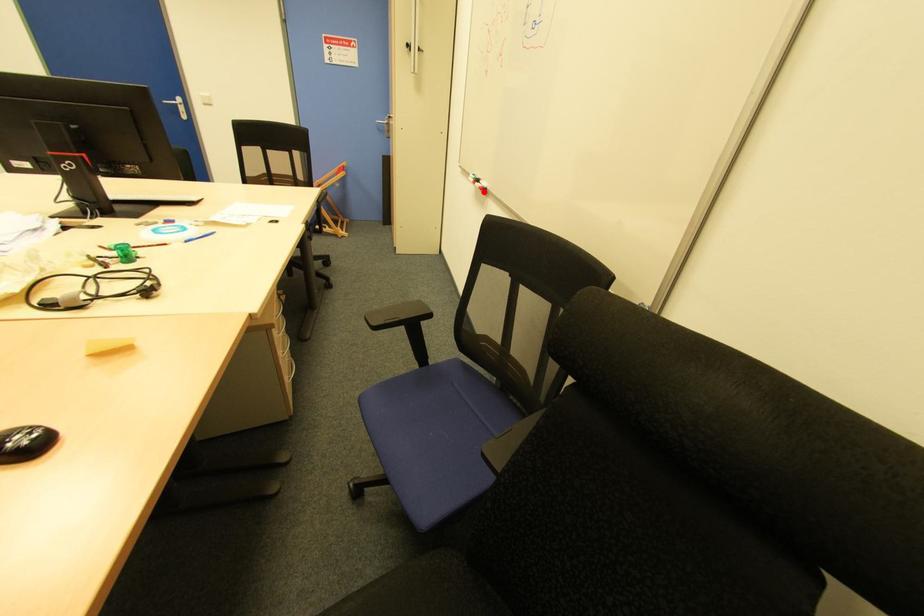
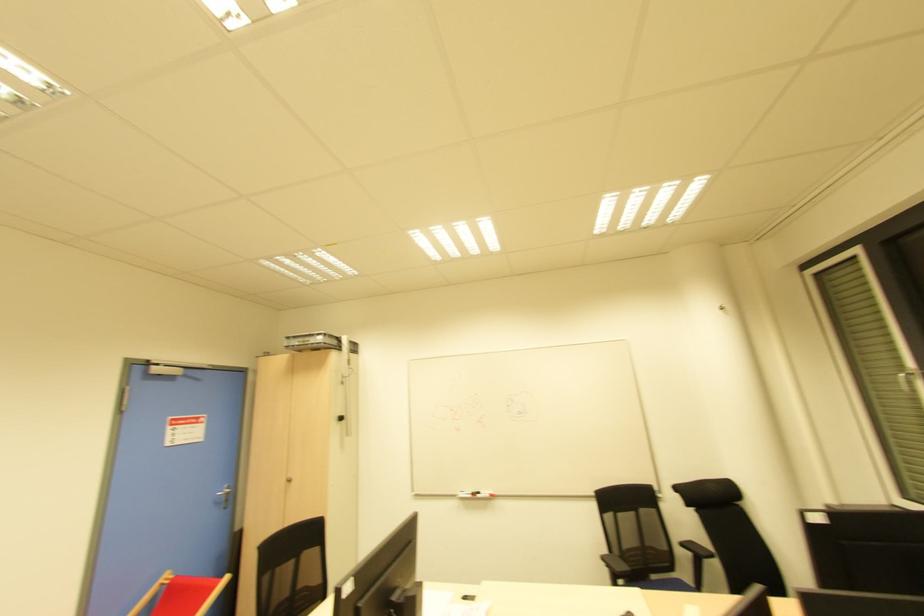
Locate, in the second image, the point that corresponds to the highlighted location in the first image.

(492, 496)